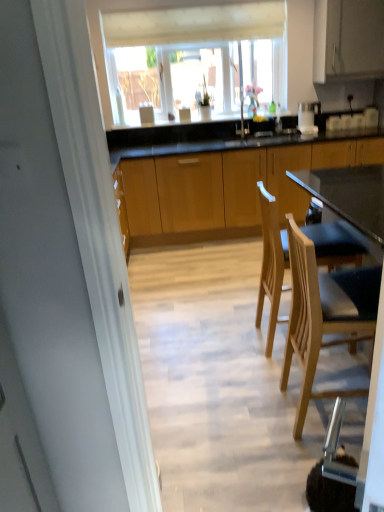
Question: Would you say transparent glass window at upper center is inside or outside light wood chair at right, which appears as the first chair when viewed from the back?

Choices:
 (A) inside
 (B) outside

Answer: (B)

Question: From a real-world perspective, relative to light wood chair at right, which appears as the first chair when viewed from the back, is transparent glass window at upper center vertically above or below?

Choices:
 (A) above
 (B) below

Answer: (A)

Question: Which of these objects is positioned farthest from the white matte cabinet at upper right, placed as the first cabinetry when sorted from top to bottom?

Choices:
 (A) light wood chair at lower right, which is the second chair from back to front
 (B) light wood chair at right, which appears as the first chair when viewed from the back
 (C) transparent glass window at upper center
 (D) wooden cabinets at center, the 1th cabinetry ordered from the bottom

Answer: (A)

Question: Considering the real-world distances, which object is farthest from the transparent glass window at upper center?

Choices:
 (A) wooden cabinets at center, the 1th cabinetry ordered from the bottom
 (B) light wood chair at right, arranged as the second chair when viewed from the front
 (C) light wood chair at lower right, which is the second chair from back to front
 (D) white matte cabinet at upper right, placed as the first cabinetry when sorted from top to bottom

Answer: (C)